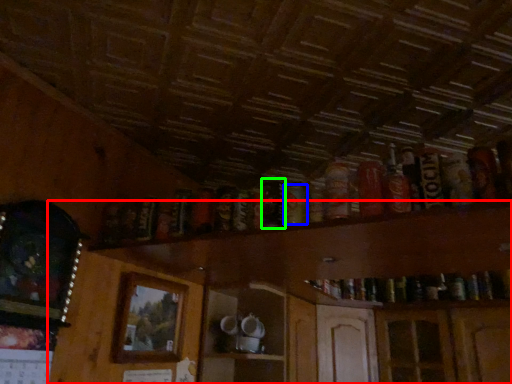
Question: Considering the real-world distances, which object is farthest from dresser (highlighted by a red box)? beer (highlighted by a blue box) or beer (highlighted by a green box)?

Choices:
 (A) beer
 (B) beer

Answer: (A)